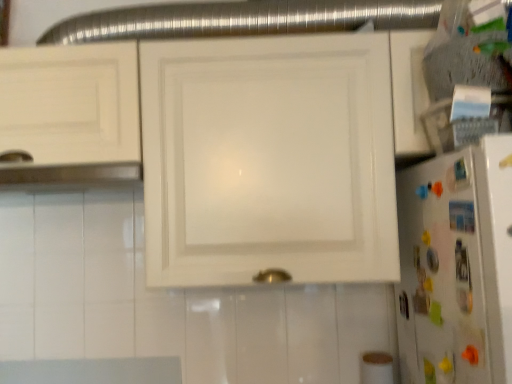
Locate an element on the screen. Image resolution: width=512 pixels, height=384 pixels. white glossy refrigerator at right is located at coordinates (456, 266).

In order to face white glossy refrigerator at right, should I rotate leftwards or rightwards?

To align with it, rotate right about 22.010°.

Describe the element at coordinates (456, 266) in the screenshot. I see `white glossy refrigerator at right` at that location.

Measure the distance between white glossy refrigerator at right and camera.

white glossy refrigerator at right and camera are 26.11 inches apart.

Find the location of a particular element. This screenshot has width=512, height=384. white glossy cabinet at center is located at coordinates (277, 154).

The image size is (512, 384). Describe the element at coordinates (277, 154) in the screenshot. I see `white glossy cabinet at center` at that location.

Locate an element on the screen. This screenshot has height=384, width=512. white glossy refrigerator at right is located at coordinates (456, 266).

Looking at this image, is white glossy refrigerator at right to the left of white glossy cabinet at center from the viewer's perspective?

Incorrect, white glossy refrigerator at right is not on the left side of white glossy cabinet at center.

Which is behind, white glossy refrigerator at right or white glossy cabinet at center?

white glossy cabinet at center is further away from the camera.

Which is behind, point (426, 175) or point (33, 122)?

The point (33, 122) is more distant.

From the image's perspective, is white glossy refrigerator at right located beneath white glossy cabinet at center?

Yes, from the image's perspective, white glossy refrigerator at right is beneath white glossy cabinet at center.

From a real-world perspective, is white glossy refrigerator at right below white glossy cabinet at center?

Yes, from a real-world perspective, white glossy refrigerator at right is below white glossy cabinet at center.

Based on the photo, which object is thinner, white glossy refrigerator at right or white glossy cabinet at center?

With smaller width is white glossy refrigerator at right.

Does white glossy refrigerator at right have a greater height compared to white glossy cabinet at center?

No.

Is white glossy refrigerator at right bigger or smaller than white glossy cabinet at center?

In the image, white glossy refrigerator at right appears to be smaller than white glossy cabinet at center.

Is white glossy refrigerator at right not inside white glossy cabinet at center?

That's correct, white glossy refrigerator at right is outside of white glossy cabinet at center.

Would you consider white glossy refrigerator at right to be distant from white glossy cabinet at center?

No, white glossy refrigerator at right is not far from white glossy cabinet at center.

Is white glossy refrigerator at right looking in the opposite direction of white glossy cabinet at center?

white glossy refrigerator at right is not turned away from white glossy cabinet at center.

Find the location of a particular element. Image resolution: width=512 pixels, height=384 pixels. refrigerator located underneath the white glossy cabinet at center (from a real-world perspective) is located at coordinates (456, 266).

Is white glossy cabinet at center at the right side of white glossy refrigerator at right?

No.

Is white glossy cabinet at center closer to camera compared to white glossy refrigerator at right?

No, it is behind white glossy refrigerator at right.

Does point (218, 226) come behind point (417, 332)?

No, (218, 226) is in front of (417, 332).

From the image's perspective, which one is positioned lower, white glossy cabinet at center or white glossy refrigerator at right?

white glossy refrigerator at right is shown below in the image.

From a real-world perspective, between white glossy cabinet at center and white glossy refrigerator at right, who is vertically higher?

white glossy cabinet at center, from a real-world perspective.

Between white glossy cabinet at center and white glossy refrigerator at right, which one has larger width?

With larger width is white glossy cabinet at center.

Considering the relative sizes of white glossy cabinet at center and white glossy refrigerator at right in the image provided, is white glossy cabinet at center taller than white glossy refrigerator at right?

Correct, white glossy cabinet at center is much taller as white glossy refrigerator at right.

Considering the sizes of white glossy cabinet at center and white glossy refrigerator at right in the image, is white glossy cabinet at center bigger or smaller than white glossy refrigerator at right?

Considering their sizes, white glossy cabinet at center takes up more space than white glossy refrigerator at right.

In the scene shown: Is white glossy cabinet at center completely or partially outside of white glossy refrigerator at right?

Yes, white glossy cabinet at center is located beyond the bounds of white glossy refrigerator at right.

Would you consider white glossy cabinet at center to be distant from white glossy refrigerator at right?

No.

Is white glossy cabinet at center looking in the opposite direction of white glossy refrigerator at right?

No, white glossy cabinet at center's orientation is not away from white glossy refrigerator at right.

How different are the orientations of white glossy cabinet at center and white glossy refrigerator at right in degrees?

The facing directions of white glossy cabinet at center and white glossy refrigerator at right are 90.1 degrees apart.

How distant is white glossy cabinet at center from white glossy refrigerator at right?

white glossy cabinet at center is 12.05 inches from white glossy refrigerator at right.

Locate an element on the screen. The width and height of the screenshot is (512, 384). refrigerator below the white glossy cabinet at center (from the image's perspective) is located at coordinates (456, 266).

You are a GUI agent. You are given a task and a screenshot of the screen. Output one action in this format:
    pyautogui.click(x=<x>, y=<y>)
    Task: Click on the refrigerator below the white glossy cabinet at center (from the image's perspective)
    The image size is (512, 384).
    Given the screenshot: What is the action you would take?
    pyautogui.click(x=456, y=266)

Where is `cabinetry above the white glossy refrigerator at right (from the image's perspective)`? cabinetry above the white glossy refrigerator at right (from the image's perspective) is located at coordinates (277, 154).